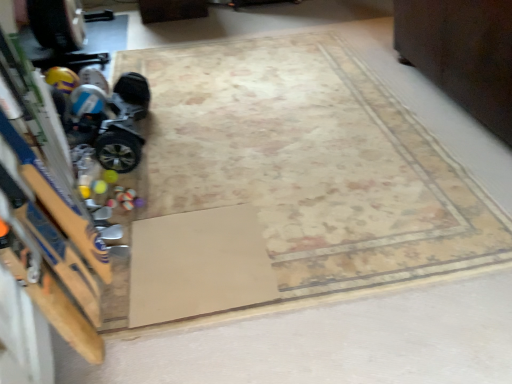
Question: Relative to beige carpet at center, is dark wood dresser at upper right in front or behind?

Choices:
 (A) front
 (B) behind

Answer: (B)

Question: From a real-world perspective, is dark wood dresser at upper right positioned above or below beige carpet at center?

Choices:
 (A) below
 (B) above

Answer: (B)

Question: Estimate the real-world distances between objects in this image. Which object is closer to the beige carpet at center?

Choices:
 (A) dark wood dresser at upper right
 (B) shiny metallic hoverboard at left
 (C) brown cardboard at center

Answer: (C)

Question: Which object is positioned farthest from the shiny metallic hoverboard at left?

Choices:
 (A) beige carpet at center
 (B) dark wood dresser at upper right
 (C) brown cardboard at center

Answer: (B)